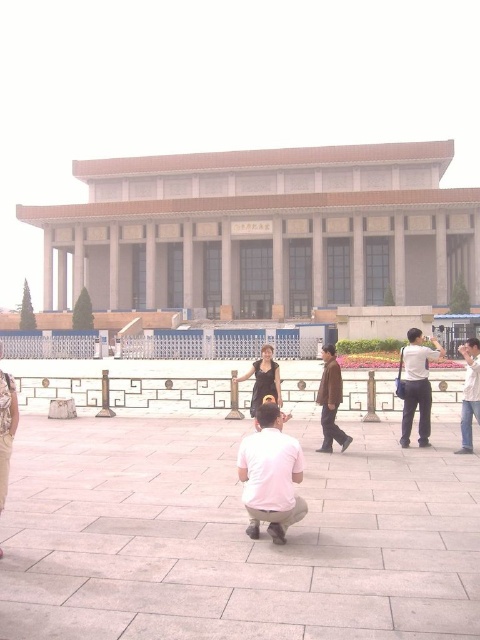
Who is positioned more to the right, white matte shirt at center or white cotton shirt at right?

white cotton shirt at right is more to the right.

Can you confirm if white matte shirt at center is positioned above white cotton shirt at right?

No, white matte shirt at center is not above white cotton shirt at right.

Measure the distance between white matte shirt at center and camera.

white matte shirt at center is 7.15 meters away from camera.

The width and height of the screenshot is (480, 640). In order to click on white matte shirt at center in this screenshot , I will do (x=271, y=476).

Can you confirm if light gray pants at right is positioned below brown leather jacket at center?

No.

Does point (407, 346) come behind point (324, 404)?

Yes, point (407, 346) is behind point (324, 404).

The width and height of the screenshot is (480, 640). What are the coordinates of `light gray pants at right` in the screenshot? It's located at (417, 385).

This screenshot has width=480, height=640. Describe the element at coordinates (271, 476) in the screenshot. I see `white matte shirt at center` at that location.

Which is more to the right, white matte shirt at center or brown leather jacket at center?

From the viewer's perspective, brown leather jacket at center appears more on the right side.

Which is in front, point (286, 508) or point (335, 390)?

Point (286, 508) is more forward.

Locate an element on the screen. white matte shirt at center is located at coordinates (271, 476).